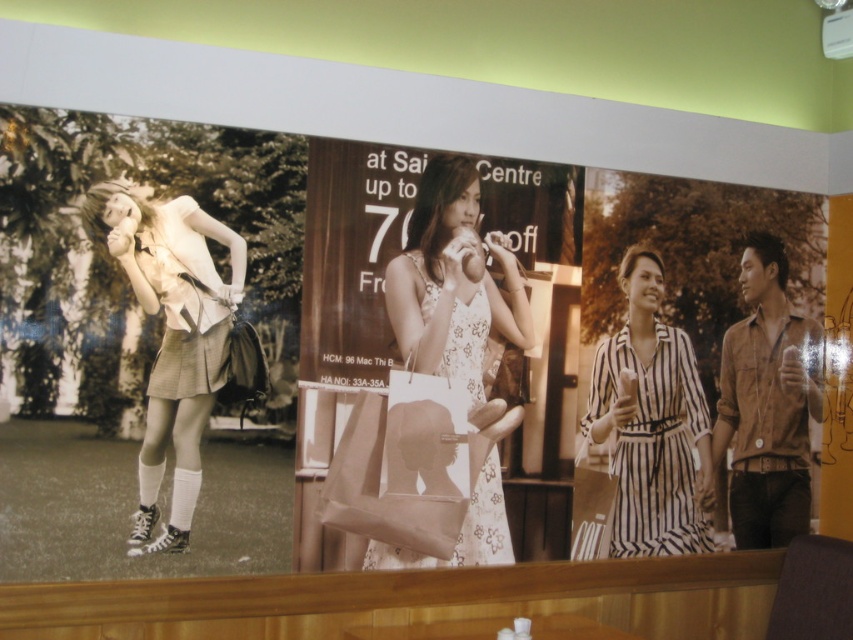
Question: Which of these objects is positioned farthest from the striped fabric dress at center?

Choices:
 (A) white floral dress at center
 (B) plaid skirt at left
 (C) brown textured shirt at right

Answer: (B)

Question: Considering the relative positions of plaid skirt at left and white floral dress at center in the image provided, where is plaid skirt at left located with respect to white floral dress at center?

Choices:
 (A) right
 (B) left

Answer: (B)

Question: Based on their relative distances, which object is farther from the striped fabric dress at center?

Choices:
 (A) white floral dress at center
 (B) brown textured shirt at right

Answer: (A)

Question: Which object is farther from the camera taking this photo?

Choices:
 (A) brown textured shirt at right
 (B) white floral dress at center
 (C) striped fabric dress at center

Answer: (A)

Question: Is plaid skirt at left in front of striped fabric dress at center?

Choices:
 (A) yes
 (B) no

Answer: (A)

Question: Does plaid skirt at left have a smaller size compared to brown textured shirt at right?

Choices:
 (A) yes
 (B) no

Answer: (B)